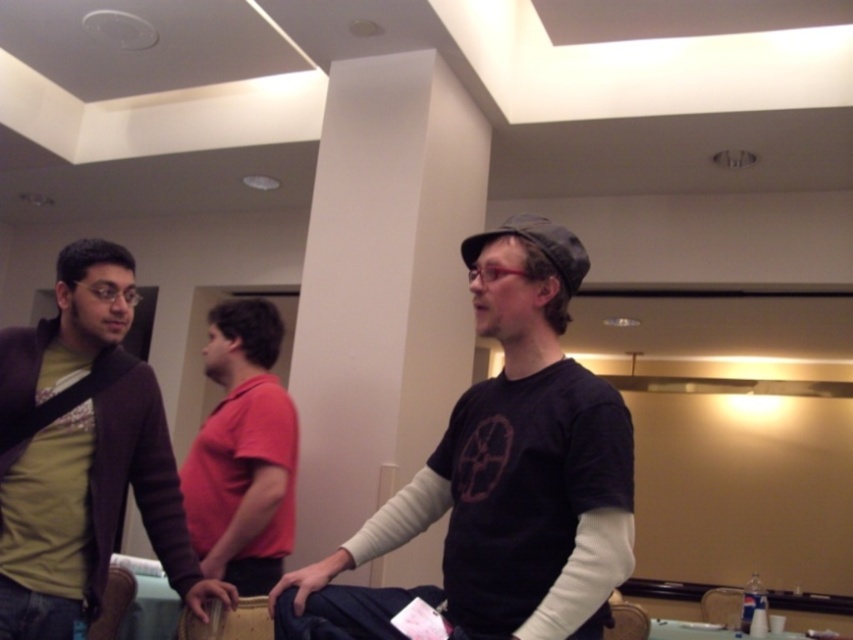
You are a security camera monitoring the conference room. You notice two objects in the scene described. Which object is taller, the matte blue jeans at lower center or the wooden textured hand at lower left?

The matte blue jeans at lower center is taller than the wooden textured hand at lower left according to the description.